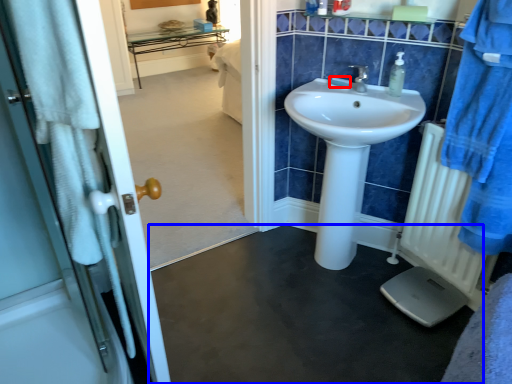
Question: Which object is further to the camera taking this photo, soap (highlighted by a red box) or plain (highlighted by a blue box)?

Choices:
 (A) soap
 (B) plain

Answer: (A)